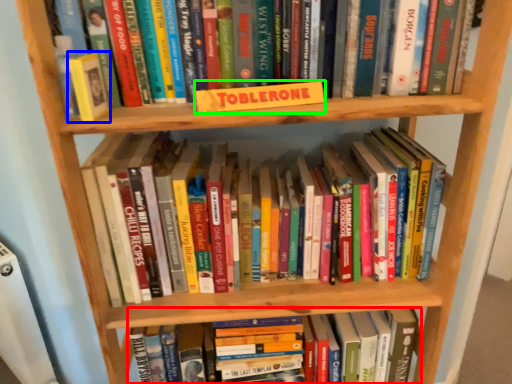
Question: Which object is positioned farthest from book (highlighted by a red box)? Select from paperback book (highlighted by a blue box) and paperback book (highlighted by a green box).

Choices:
 (A) paperback book
 (B) paperback book

Answer: (A)